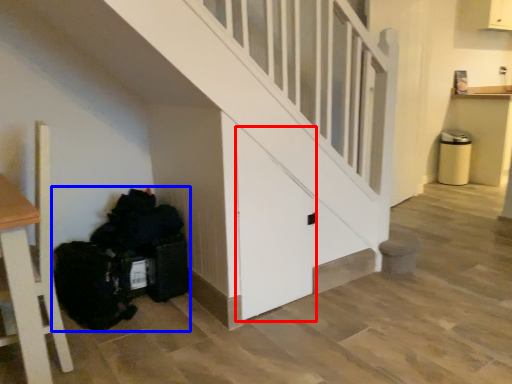
Question: Which point is further to the camera, door (highlighted by a red box) or garbage (highlighted by a blue box)?

Choices:
 (A) door
 (B) garbage

Answer: (B)